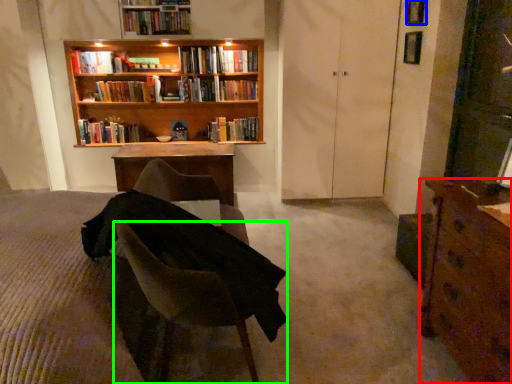
Question: Based on their relative distances, which object is farther from desk (highlighted by a red box)? Choose from window (highlighted by a blue box) and chair (highlighted by a green box).

Choices:
 (A) window
 (B) chair

Answer: (A)